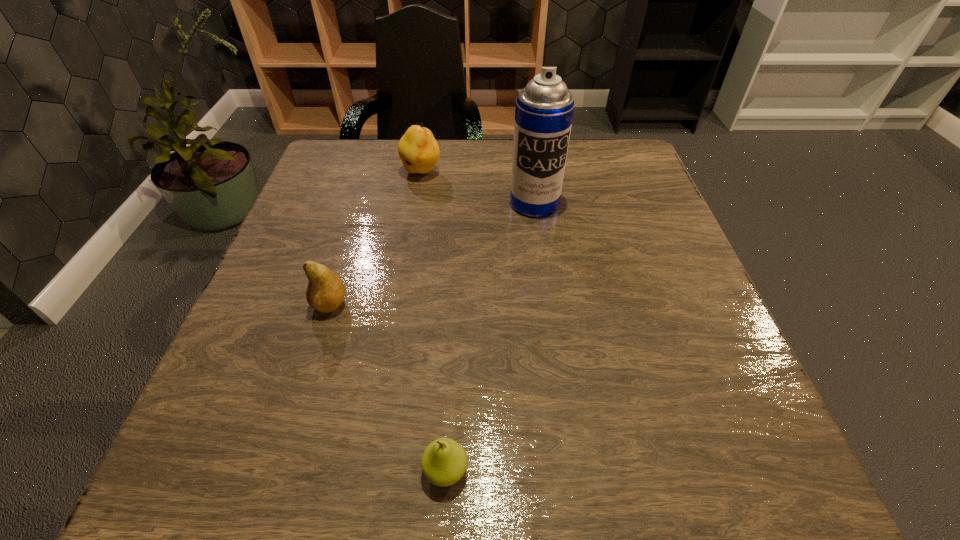
Identify the location of blank area located on the front of the second nearest pear. The image size is (960, 540). (272, 495).

This screenshot has height=540, width=960. What are the coordinates of `vacant space located 0.250m on the right of the nearest pear` in the screenshot? It's located at (654, 470).

Where is `aerosol can that is at the far edge`? The height and width of the screenshot is (540, 960). aerosol can that is at the far edge is located at coordinates (544, 109).

The height and width of the screenshot is (540, 960). In order to click on pear at the far edge in this screenshot , I will do [x=419, y=151].

Locate an element on the screen. This screenshot has width=960, height=540. object at the near edge is located at coordinates (444, 461).

This screenshot has width=960, height=540. Find the location of `object that is at the left edge`. object that is at the left edge is located at coordinates click(x=325, y=292).

In the image, there is a desktop. Where is `vacant space at the far edge`? The height and width of the screenshot is (540, 960). vacant space at the far edge is located at coordinates (444, 150).

Image resolution: width=960 pixels, height=540 pixels. In order to click on free location at the near edge of the desktop in this screenshot , I will do `click(560, 496)`.

Find the location of `free space at the left edge of the desktop`. free space at the left edge of the desktop is located at coordinates (341, 224).

Locate an element on the screen. free space at the right edge is located at coordinates coord(691,273).